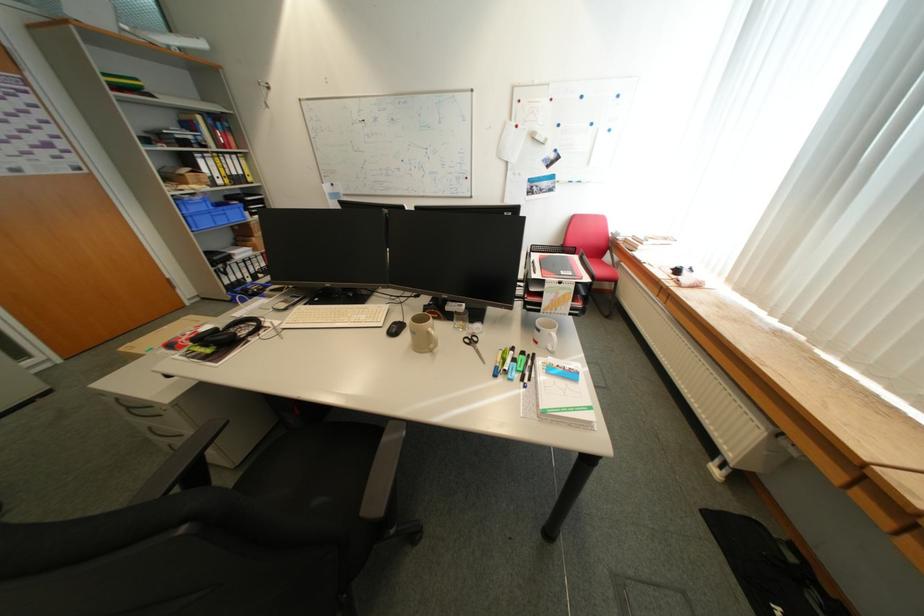
Which object does [472,342] point to?

This point indicates the pair of scissors.